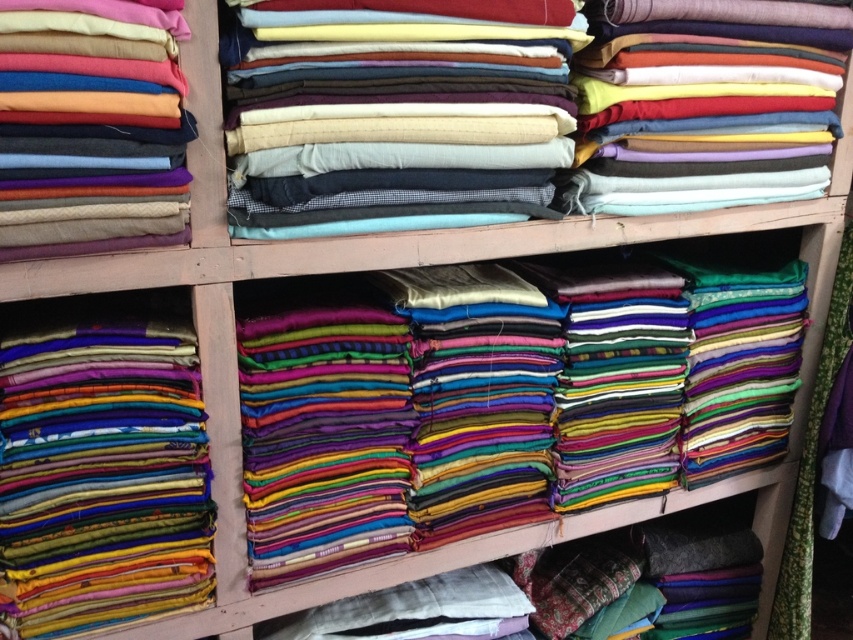
Question: Does matte fabric stack at center appear under shiny silk fabric at lower left?

Choices:
 (A) yes
 (B) no

Answer: (B)

Question: Which object is positioned farthest from the shiny silk fabric at lower left?

Choices:
 (A) matte fabric stack at upper right
 (B) matte woolen fabric at left
 (C) matte fabric stack at center

Answer: (A)

Question: Estimate the real-world distances between objects in this image. Which object is farther from the shiny silk fabric at lower left?

Choices:
 (A) matte fabric stack at upper right
 (B) matte woolen fabric at left
 (C) matte fabric stack at center

Answer: (A)

Question: Does shiny silk fabric at lower left have a smaller size compared to matte woolen fabric at left?

Choices:
 (A) no
 (B) yes

Answer: (A)

Question: Considering the real-world distances, which object is closest to the shiny silk fabric at lower left?

Choices:
 (A) matte fabric stack at upper right
 (B) matte fabric stack at center
 (C) matte woolen fabric at left

Answer: (C)

Question: Is matte fabric stack at center positioned before shiny silk fabric at lower left?

Choices:
 (A) no
 (B) yes

Answer: (B)